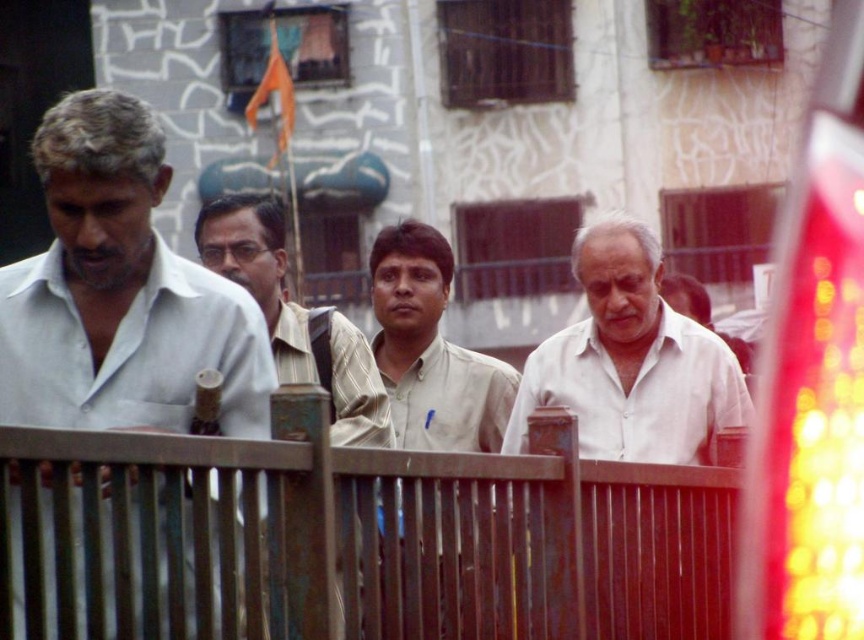
You are a photographer taking a picture of the group of men walking past the metal gate. You want to ensure that both the white matte shirt at center and the striped fabric shirt at center are clearly visible in the frame. Which shirt should you focus on first to capture both in the shot?

The white matte shirt at center is positioned on the right side of the striped fabric shirt at center, so focusing on the striped fabric shirt at center first would allow you to frame both shirts in the shot since the white matte shirt at center is to its right.

You are a photographer positioned at the center of the scene. You want to capture a photo of the white matte shirt at left. Which direction should you aim your camera to ensure the subject is in frame?

The white matte shirt at left is located at point (119,292), so you should aim your camera to the left side of the scene to capture it.